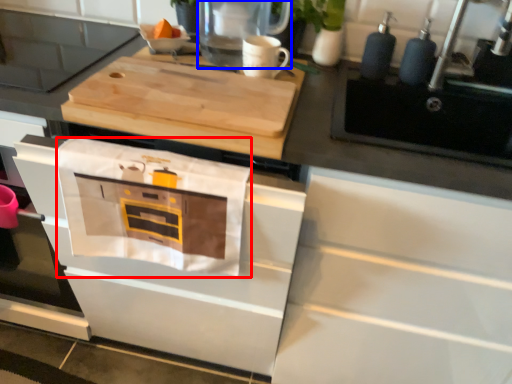
Question: Which object is closer to the camera taking this photo, cloth (highlighted by a red box) or kitchen appliance (highlighted by a blue box)?

Choices:
 (A) cloth
 (B) kitchen appliance

Answer: (A)